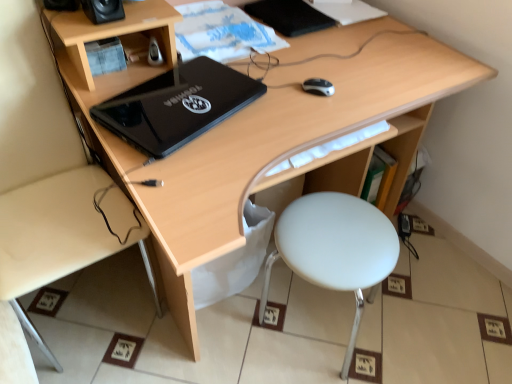
Locate an element on the screen. This screenshot has width=512, height=384. vacant space in light wood desk at lower left (from a real-world perspective) is located at coordinates (88, 301).